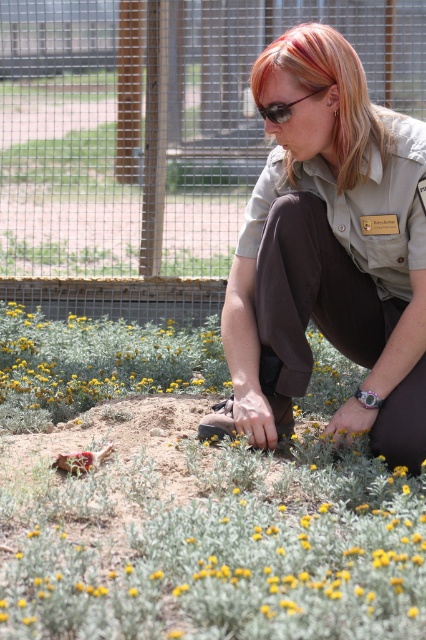
Question: Which of the following is the closest to the observer?

Choices:
 (A) brown uniform at center
 (B) matte black sunglasses at center
 (C) blonde hair at center

Answer: (C)

Question: Observing the image, what is the correct spatial positioning of brown uniform at center in reference to matte black sunglasses at center?

Choices:
 (A) above
 (B) below

Answer: (B)

Question: Does brown uniform at center appear on the right side of matte black sunglasses at center?

Choices:
 (A) no
 (B) yes

Answer: (B)

Question: Which point is closer to the camera?

Choices:
 (A) (275, 122)
 (B) (304, 188)

Answer: (A)

Question: Which of the following is the farthest from the observer?

Choices:
 (A) blonde hair at center
 (B) brown uniform at center

Answer: (B)

Question: Is brown uniform at center wider than matte black sunglasses at center?

Choices:
 (A) yes
 (B) no

Answer: (A)